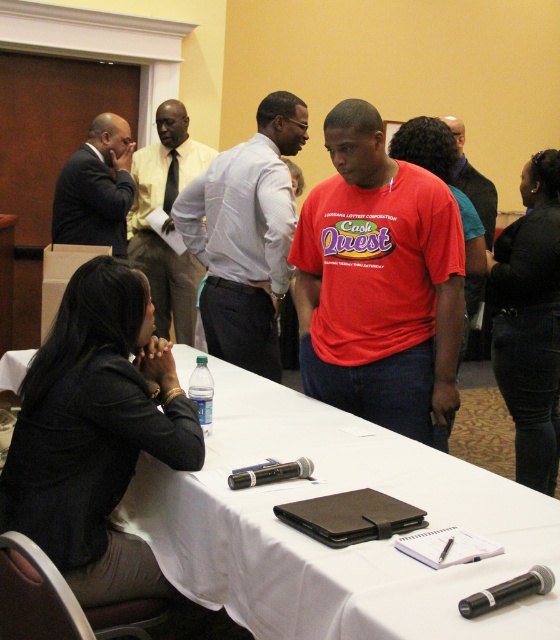
Based on the photo, can you confirm if black fabric jacket at lower left is bigger than red matte shirt at center?

No.

Is black fabric jacket at lower left taller than red matte shirt at center?

Indeed, black fabric jacket at lower left has a greater height compared to red matte shirt at center.

Which is in front, point (81, 396) or point (466, 193)?

Point (81, 396) is more forward.

This screenshot has width=560, height=640. In order to click on black fabric jacket at lower left in this screenshot , I will do `click(96, 433)`.

Can you confirm if matte red t-shirt at center is positioned to the left of black fabric jacket at lower left?

In fact, matte red t-shirt at center is to the right of black fabric jacket at lower left.

Which is behind, point (312, 285) or point (53, 481)?

Positioned behind is point (312, 285).

In order to click on matte red t-shirt at center in this screenshot , I will do `click(380, 282)`.

Does black leather jacket at lower right lie in front of red matte shirt at center?

That is True.

Can you confirm if black leather jacket at lower right is bigger than red matte shirt at center?

Actually, black leather jacket at lower right might be smaller than red matte shirt at center.

I want to click on black leather jacket at lower right, so click(529, 321).